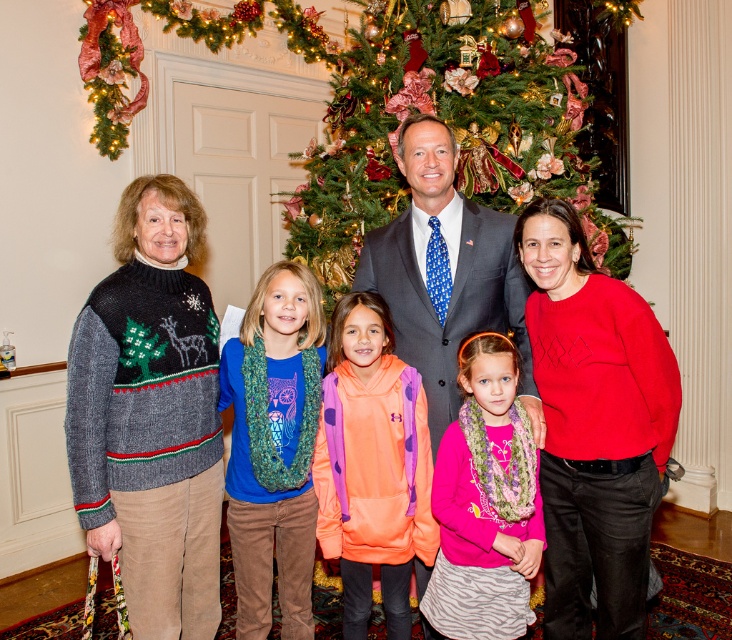
You are a photographer trying to adjust the camera focus to capture both the orange fleece hoodie at center and the knitted sweater at center clearly. Which clothing item should you focus on first to ensure it appears sharp in the photo?

The orange fleece hoodie at center is not as tall as the knitted sweater at center, so you should focus on the knitted sweater at center first because it is taller and might require more precise focusing to capture details.

You are standing in the room where the green textured christmas tree at center is located. If you face the tree and look directly ahead, which direction would the white door behind the tree be relative to your line of sight?

The white door is behind the green textured christmas tree at center, so if you face the tree and look directly ahead, the white door would be directly behind you in that line of sight.